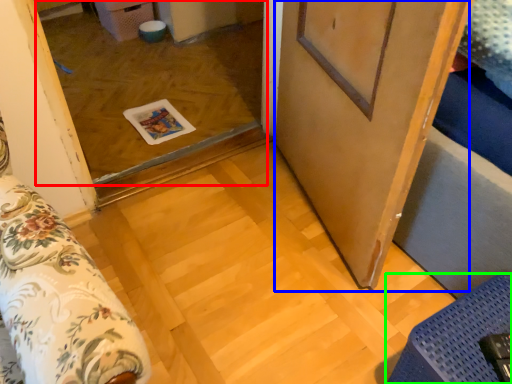
Question: Which is nearer to the window (highlighted by a red box)? barn door (highlighted by a blue box) or furniture (highlighted by a green box).

Choices:
 (A) barn door
 (B) furniture

Answer: (A)